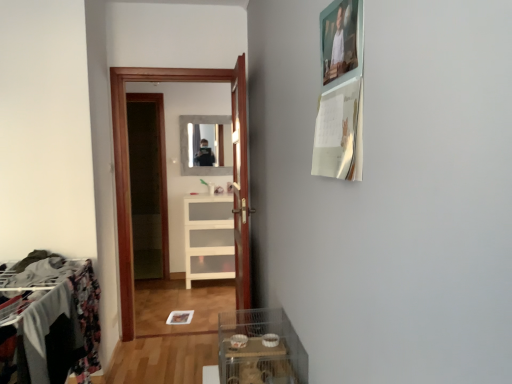
Where is `white glossy cabinet at center`? The width and height of the screenshot is (512, 384). white glossy cabinet at center is located at coordinates (128, 156).

In order to face metallic wire rack at left, should I rotate leftwards or rightwards?

To align with it, rotate left about 23.078°.

Locate an element on the screen. Image resolution: width=512 pixels, height=384 pixels. white glossy cabinet at center is located at coordinates (209, 238).

Locate an element on the screen. wooden door at center is located at coordinates (240, 183).

What are the coordinates of `white glossy cabinet at center` in the screenshot? It's located at (128, 156).

Is transparent plastic container at lower center inside or outside of white glossy cabinet at center?

transparent plastic container at lower center is not enclosed by white glossy cabinet at center.

Is transparent plastic container at lower center at the right side of white glossy cabinet at center?

Indeed, transparent plastic container at lower center is positioned on the right side of white glossy cabinet at center.

Which of these two, transparent plastic container at lower center or white glossy cabinet at center, stands shorter?

transparent plastic container at lower center is shorter.

Is transparent plastic container at lower center aimed at white glossy cabinet at center?

No, transparent plastic container at lower center is not turned towards white glossy cabinet at center.

Is white glossy cabinet at center in contact with metallic wire rack at left?

No.

The image size is (512, 384). Find the location of `furniture that is in front of the white glossy cabinet at center`. furniture that is in front of the white glossy cabinet at center is located at coordinates (58, 321).

From a real-world perspective, who is located lower, white glossy cabinet at center or metallic wire rack at left?

metallic wire rack at left, from a real-world perspective.

Between transparent plastic container at lower center and metallic wire rack at left, which one has less height?

With less height is transparent plastic container at lower center.

From a real-world perspective, which is physically below, transparent plastic container at lower center or metallic wire rack at left?

metallic wire rack at left is physically lower.

Is transparent plastic container at lower center positioned with its back to metallic wire rack at left?

No, transparent plastic container at lower center is not facing the opposite direction of metallic wire rack at left.

Is transparent plastic container at lower center outside of metallic wire rack at left?

Indeed, transparent plastic container at lower center is completely outside metallic wire rack at left.

Based on their sizes in the image, would you say matte glass mirror at center is bigger or smaller than transparent plastic container at lower center?

matte glass mirror at center is smaller than transparent plastic container at lower center.

Can you confirm if matte glass mirror at center is thinner than transparent plastic container at lower center?

Indeed, matte glass mirror at center has a lesser width compared to transparent plastic container at lower center.

Considering the relative sizes of matte glass mirror at center and transparent plastic container at lower center in the image provided, is matte glass mirror at center taller than transparent plastic container at lower center?

Yes.

Locate an element on the screen. Image resolution: width=512 pixels, height=384 pixels. mirror that appears above the transparent plastic container at lower center (from a real-world perspective) is located at coordinates (187, 145).

Does white glossy cabinet at center have a lesser height compared to transparent plastic container at lower center?

Incorrect, the height of white glossy cabinet at center does not fall short of that of transparent plastic container at lower center.

Is white glossy cabinet at center positioned with its back to transparent plastic container at lower center?

white glossy cabinet at center does not have its back to transparent plastic container at lower center.

How many degrees apart are the facing directions of white glossy cabinet at center and transparent plastic container at lower center?

89.6 degrees.

Does white glossy cabinet at center come in front of transparent plastic container at lower center?

No, white glossy cabinet at center is further to the viewer.

Is metallic wire rack at left situated inside wooden door at center or outside?

metallic wire rack at left is outside wooden door at center.

Which of these two, metallic wire rack at left or wooden door at center, stands shorter?

metallic wire rack at left.

Which is behind, metallic wire rack at left or wooden door at center?

wooden door at center is behind.

Is wooden door at center at the back of transparent plastic container at lower center?

transparent plastic container at lower center is not turned away from wooden door at center.

Does point (265, 360) lie in front of point (247, 236)?

Yes, point (265, 360) is in front of point (247, 236).

Is transparent plastic container at lower center in front of or behind wooden door at center in the image?

transparent plastic container at lower center is positioned closer to the viewer than wooden door at center.

From the image's perspective, which one is positioned lower, transparent plastic container at lower center or wooden door at center?

transparent plastic container at lower center.

Where is `clothing store behind the transparent plastic container at lower center`? This screenshot has height=384, width=512. clothing store behind the transparent plastic container at lower center is located at coordinates (128, 156).

Image resolution: width=512 pixels, height=384 pixels. Identify the location of furniture below the white glossy cabinet at center (from a real-world perspective). (58, 321).

When comparing their distances from white glossy cabinet at center, does wooden door at center or metallic wire rack at left seem further?

The object further to white glossy cabinet at center is metallic wire rack at left.

From the image, which object appears to be nearer to white glossy cabinet at center, white glossy cabinet at center or metallic wire rack at left?

Based on the image, white glossy cabinet at center appears to be nearer to white glossy cabinet at center.

From the image, which object appears to be farther from metallic wire rack at left, wooden door at center or matte glass mirror at center?

Among the two, matte glass mirror at center is located further to metallic wire rack at left.

Looking at the image, which one is located further to matte glass mirror at center, white glossy cabinet at center or wooden door at center?

Among the two, wooden door at center is located further to matte glass mirror at center.

Looking at the image, which one is located closer to metallic wire rack at left, transparent plastic container at lower center or white glossy cabinet at center?

transparent plastic container at lower center lies closer to metallic wire rack at left than the other object.

Which object lies further to the anchor point metallic wire rack at left, white glossy cabinet at center or white glossy cabinet at center?

The object further to metallic wire rack at left is white glossy cabinet at center.

From the picture: Based on their spatial positions, is transparent plastic container at lower center or metallic wire rack at left closer to white glossy cabinet at center?

Based on the image, metallic wire rack at left appears to be nearer to white glossy cabinet at center.

When comparing their distances from transparent plastic container at lower center, does metallic wire rack at left or wooden door at center seem further?

metallic wire rack at left is further to transparent plastic container at lower center.

At what (x,y) coordinates should I click in order to perform the action: click on clothing store between wooden door at center and matte glass mirror at center in the front-back direction. Please return your answer as a coordinate pair (x, y). Looking at the image, I should click on (128, 156).

Find the location of a particular element. The height and width of the screenshot is (384, 512). furniture between transparent plastic container at lower center and matte glass mirror at center in the front-back direction is located at coordinates (58, 321).

Where is `furniture between transparent plastic container at lower center and white glossy cabinet at center in the front-back direction`? This screenshot has height=384, width=512. furniture between transparent plastic container at lower center and white glossy cabinet at center in the front-back direction is located at coordinates (58, 321).

Where is `cabinetry located between metallic wire rack at left and matte glass mirror at center in the depth direction`? The image size is (512, 384). cabinetry located between metallic wire rack at left and matte glass mirror at center in the depth direction is located at coordinates (209, 238).